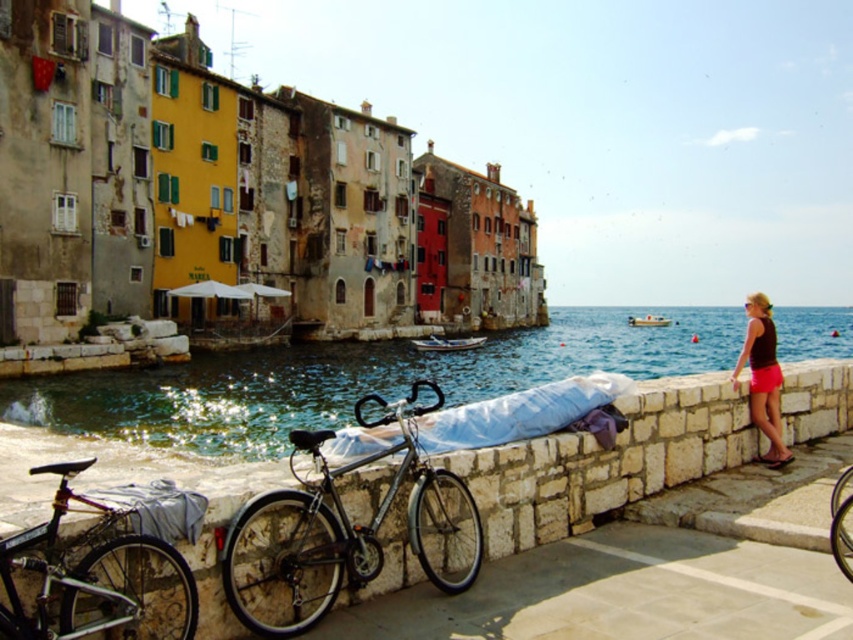
Question: Which of the following is the closest to the observer?

Choices:
 (A) clear blue water at lower center
 (B) stone wall at lower center
 (C) shiny metallic bicycle at lower right

Answer: (B)

Question: Is stone wall at lower center wider than white fabric blanket at center?

Choices:
 (A) no
 (B) yes

Answer: (B)

Question: In this image, where is shiny metallic bicycle at center located relative to white fabric blanket at center?

Choices:
 (A) left
 (B) right

Answer: (A)

Question: Can you confirm if stone wall at lower center is thinner than white fabric blanket at center?

Choices:
 (A) no
 (B) yes

Answer: (A)

Question: Among these points, which one is farthest from the camera?

Choices:
 (A) (369, 429)
 (B) (625, 458)
 (C) (759, 333)

Answer: (C)

Question: Which of the following is the closest to the observer?

Choices:
 (A) shiny metallic bicycle at lower left
 (B) stone wall at lower center

Answer: (A)